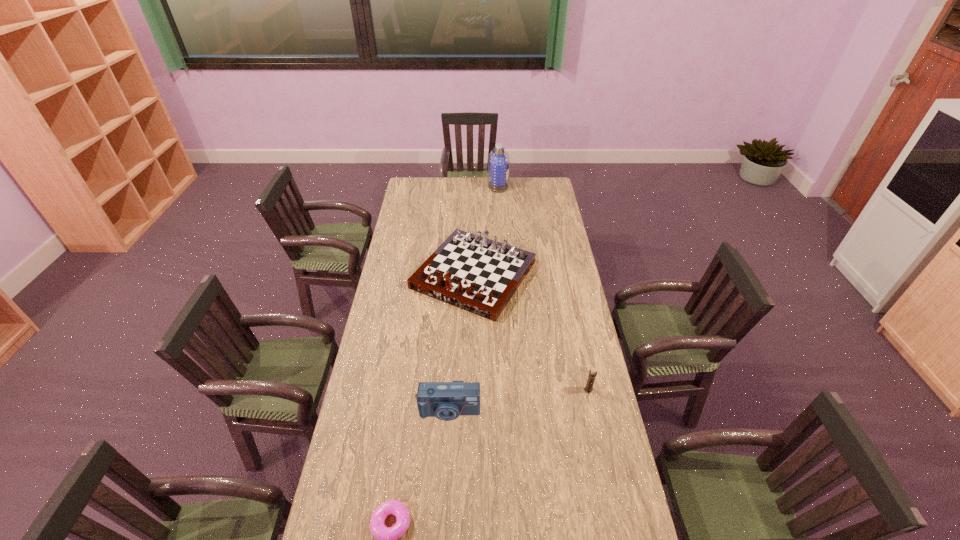
The image size is (960, 540). Find the location of `object that is the fourth closest to the fourth farthest object`. object that is the fourth closest to the fourth farthest object is located at coordinates (498, 160).

This screenshot has height=540, width=960. What are the coordinates of `object that stands as the third closest to the cleansing agent` in the screenshot? It's located at (446, 401).